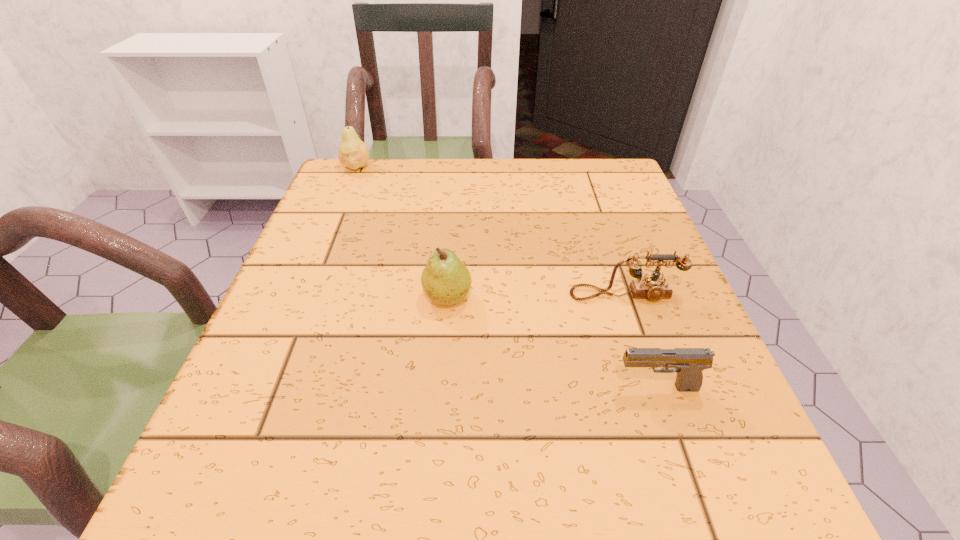
In the image, there is a desktop. Where is `blank space at the far left corner`? The image size is (960, 540). blank space at the far left corner is located at coordinates (359, 205).

In order to click on free region at the far right corner of the desktop in this screenshot , I will do `click(566, 186)`.

Locate an element on the screen. Image resolution: width=960 pixels, height=540 pixels. vacant space at the near right corner of the desktop is located at coordinates (737, 494).

Identify the location of empty space that is in between the right pear and the telephone. The width and height of the screenshot is (960, 540). (537, 296).

The height and width of the screenshot is (540, 960). In order to click on vacant space in between the leftmost object and the nearest object in this screenshot , I will do `click(506, 278)`.

This screenshot has height=540, width=960. Find the location of `empty location between the nearer pear and the leftmost object`. empty location between the nearer pear and the leftmost object is located at coordinates (402, 232).

Where is `vacant area between the farther pear and the telephone`? The width and height of the screenshot is (960, 540). vacant area between the farther pear and the telephone is located at coordinates (491, 231).

The image size is (960, 540). What are the coordinates of `free space between the pistol and the second object from left to right` in the screenshot? It's located at (552, 342).

The height and width of the screenshot is (540, 960). What are the coordinates of `vacant region between the telephone and the right pear` in the screenshot? It's located at (537, 296).

Find the location of a particular element. The height and width of the screenshot is (540, 960). vacant area between the third object from right to left and the telephone is located at coordinates (537, 296).